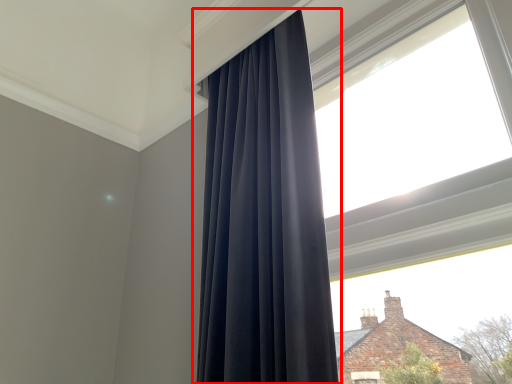
Question: From the image's perspective, what is the correct spatial relationship of curtain (annotated by the red box) in relation to window?

Choices:
 (A) above
 (B) below

Answer: (B)